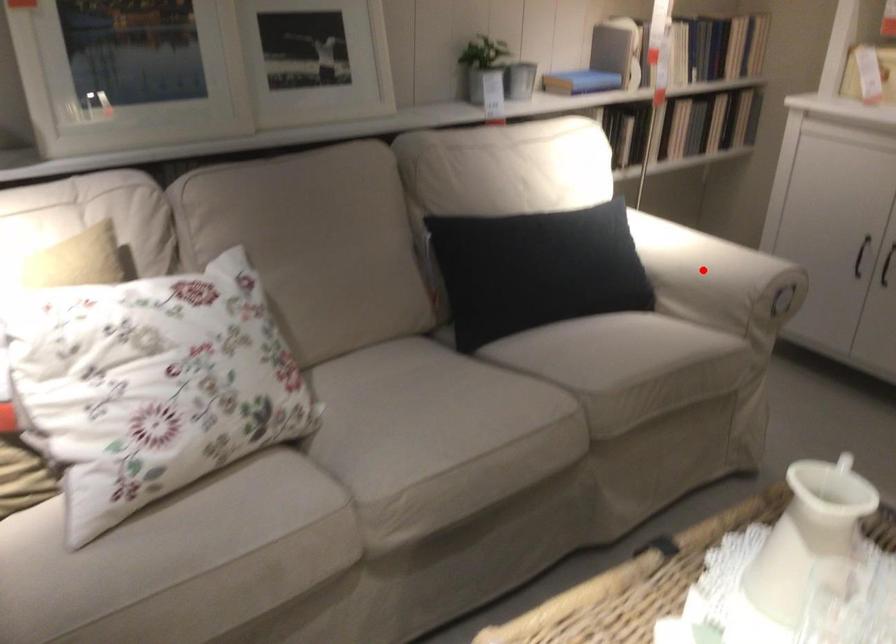
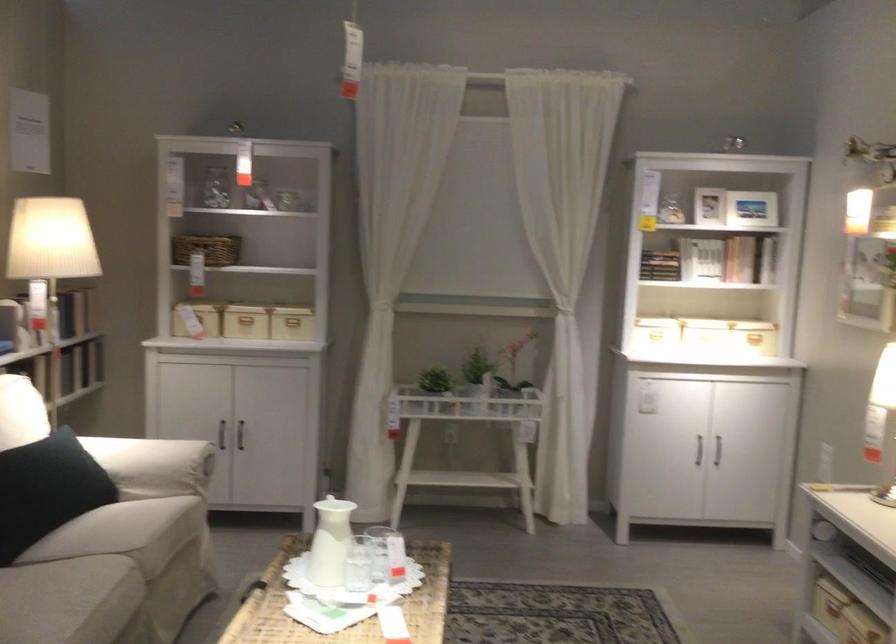
Question: I am providing you with two images of the same scene from different viewpoints. Given a red point in image1, look at the same physical point in image2. Is it:

Choices:
 (A) Closer to the viewpoint
 (B) Farther from the viewpoint

Answer: (B)